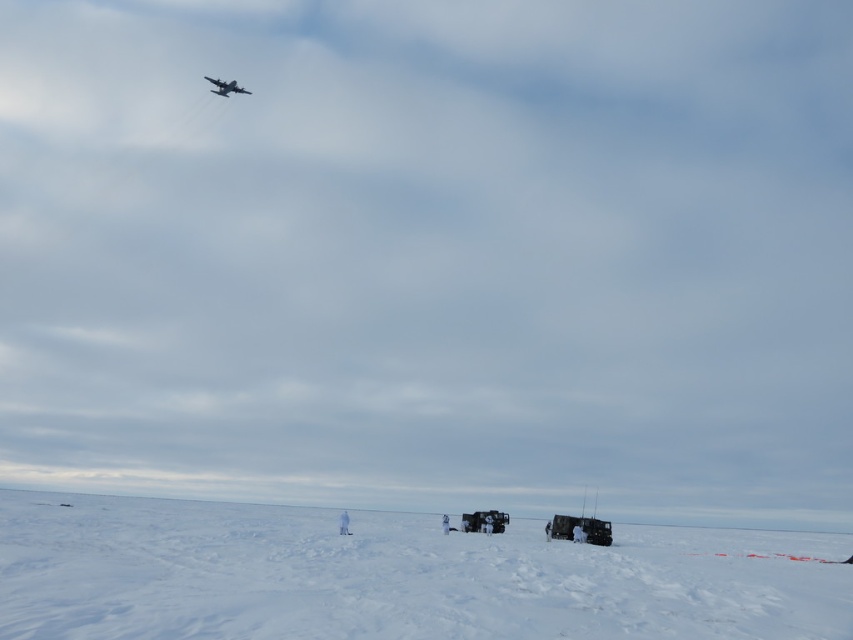
Who is shorter, white powdery snow at lower center or white matte skier at lower center?

white matte skier at lower center is shorter.

Between white powdery snow at lower center and white matte skier at lower center, which one appears on the right side from the viewer's perspective?

Positioned to the right is white powdery snow at lower center.

Between point (79, 508) and point (347, 522), which one is positioned in front?

Point (347, 522) is in front.

Locate an element on the screen. The height and width of the screenshot is (640, 853). white powdery snow at lower center is located at coordinates (x=393, y=577).

Can you confirm if white powdery snow at lower center is wider than metallic silver aircraft at upper left?

Indeed, white powdery snow at lower center has a greater width compared to metallic silver aircraft at upper left.

What do you see at coordinates (393, 577) in the screenshot? I see `white powdery snow at lower center` at bounding box center [393, 577].

Image resolution: width=853 pixels, height=640 pixels. I want to click on white powdery snow at lower center, so click(x=393, y=577).

Does metallic silver aircraft at upper left have a larger size compared to white matte skier at lower center?

Yes, metallic silver aircraft at upper left is bigger than white matte skier at lower center.

Based on the photo, does metallic silver aircraft at upper left come behind white matte skier at lower center?

Yes.

Is point (225, 84) positioned in front of point (346, 532)?

No, it is behind (346, 532).

Identify the location of metallic silver aircraft at upper left. (225, 86).